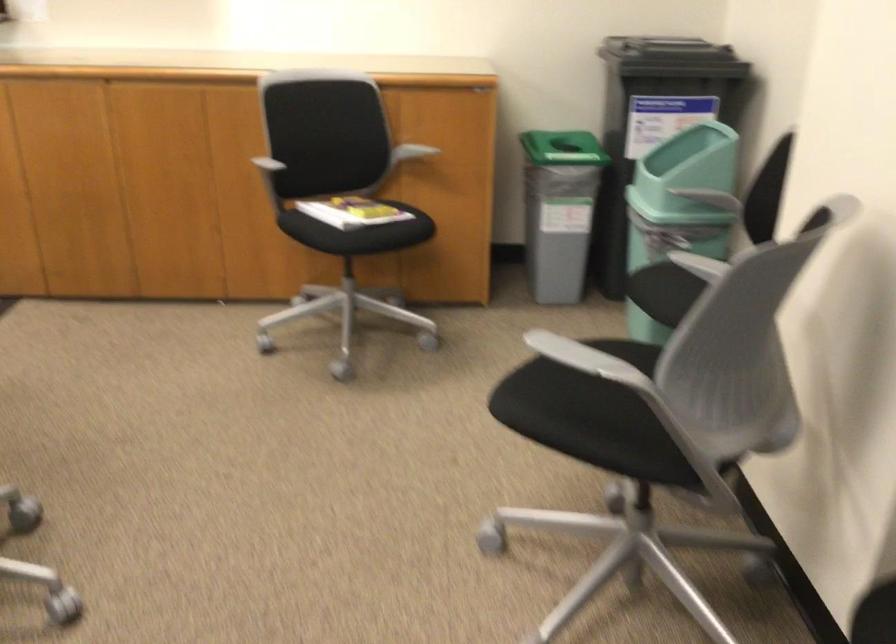
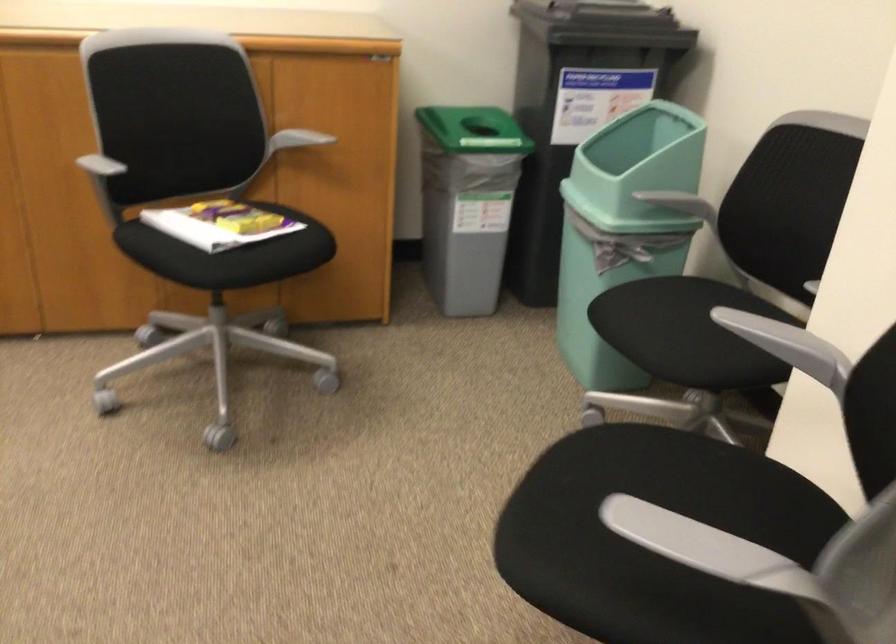
Question: The camera is either moving clockwise (left) or counter-clockwise (right) around the object. The first image is from the beginning of the video and the second image is from the end. Is the camera moving left or right when shooting the video?

Choices:
 (A) Left
 (B) Right

Answer: (A)